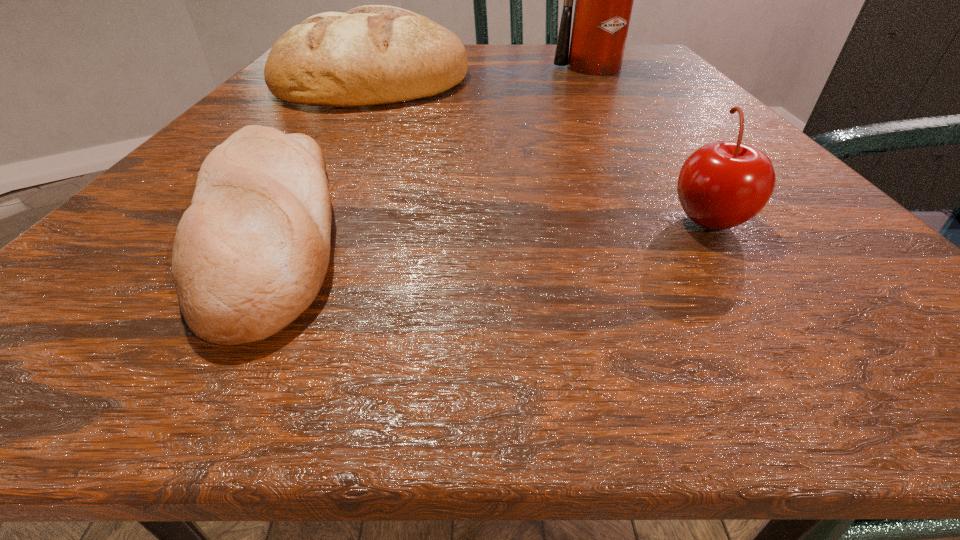
At what (x,y) coordinates should I click in order to perform the action: click on the tallest object. Please return your answer as a coordinate pair (x, y). Looking at the image, I should click on (604, 0).

I want to click on the farther bread, so click(x=370, y=55).

Identify the location of cherry. Image resolution: width=960 pixels, height=540 pixels. (723, 184).

Find the location of `the shortest object`. the shortest object is located at coordinates (250, 254).

At what (x,y) coordinates should I click in order to perform the action: click on the nearer bread. Please return your answer as a coordinate pair (x, y). This screenshot has width=960, height=540. Looking at the image, I should click on (250, 254).

Locate an element on the screen. The image size is (960, 540). free space located from the nozzle of the fire extinguisher is located at coordinates (655, 162).

The height and width of the screenshot is (540, 960). Identify the location of free space located 0.140m on the front of the farther bread. (332, 150).

Find the location of `free space located 0.290m on the back of the cherry`. free space located 0.290m on the back of the cherry is located at coordinates (629, 107).

You are a GUI agent. You are given a task and a screenshot of the screen. Output one action in this format:
    pyautogui.click(x=<x>, y=<y>)
    Task: Click on the vacant region located on the back of the nearer bread
    
    Given the screenshot: What is the action you would take?
    pyautogui.click(x=327, y=133)

At what (x,y) coordinates should I click in order to perform the action: click on fire extinguisher that is at the far edge. Please return your answer as a coordinate pair (x, y). Looking at the image, I should click on (604, 0).